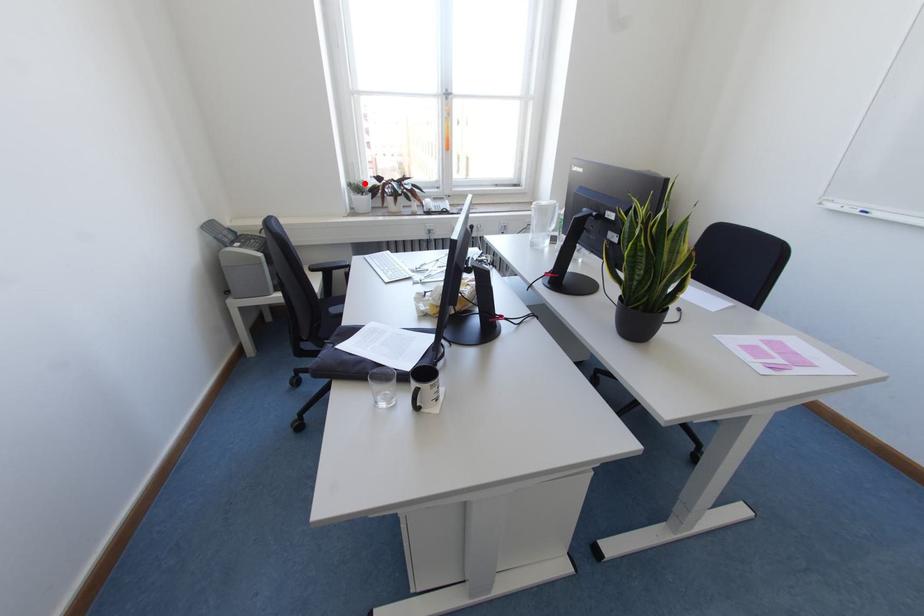
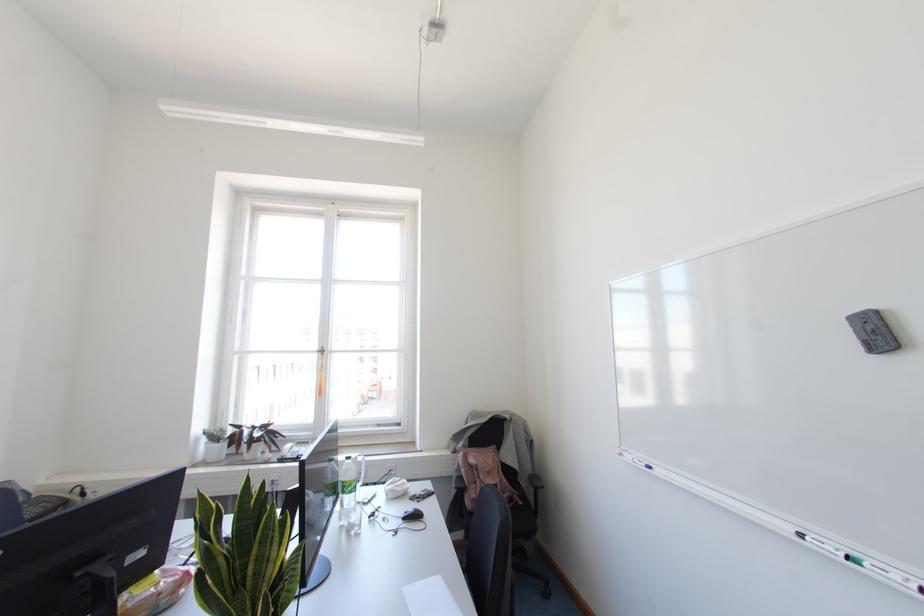
Question: I am providing you with two images of the same scene from different viewpoints. Image1 has a red point marked. In image2, the corresponding 3D location appears at what relative position? Reply with the corresponding letter.

Choices:
 (A) Closer
 (B) Farther

Answer: (B)